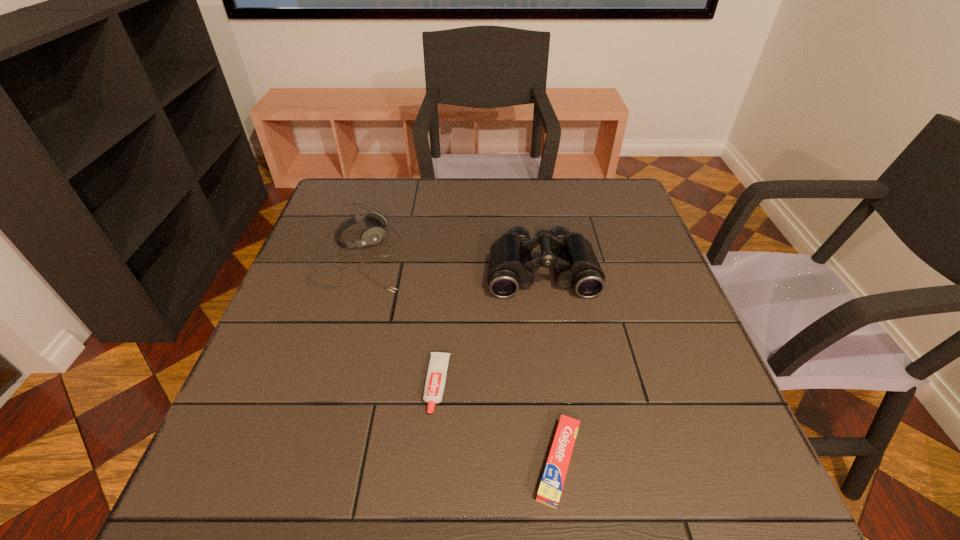
You are a GUI agent. You are given a task and a screenshot of the screen. Output one action in this format:
    pyautogui.click(x=<x>, y=<y>)
    Task: Click on the tallest object
    Image resolution: width=960 pixels, height=540 pixels.
    Given the screenshot: What is the action you would take?
    pyautogui.click(x=511, y=267)

Locate an element on the screen. The height and width of the screenshot is (540, 960). the second tallest object is located at coordinates (373, 235).

At what (x,y) coordinates should I click in order to perform the action: click on headset. Please return your answer as a coordinate pair (x, y). The image size is (960, 540). Looking at the image, I should click on (373, 235).

Identify the location of the third object from right to left. The width and height of the screenshot is (960, 540). (436, 375).

Find the location of a particular element. The width and height of the screenshot is (960, 540). the farther toothpaste is located at coordinates (436, 375).

Where is `the right toothpaste`? This screenshot has height=540, width=960. the right toothpaste is located at coordinates (553, 478).

This screenshot has width=960, height=540. Find the location of `the nearest object`. the nearest object is located at coordinates (553, 478).

What are the coordinates of `vacant space located on the front-facing side of the tallest object` in the screenshot? It's located at (552, 340).

Where is `vacant space located on the outer surface of the headset`? vacant space located on the outer surface of the headset is located at coordinates (539, 254).

You are a GUI agent. You are given a task and a screenshot of the screen. Output one action in this format:
    pyautogui.click(x=<x>, y=<y>)
    Task: Click on the free space located 0.350m on the left of the left toothpaste
    The image size is (960, 540).
    Given the screenshot: What is the action you would take?
    pyautogui.click(x=248, y=384)